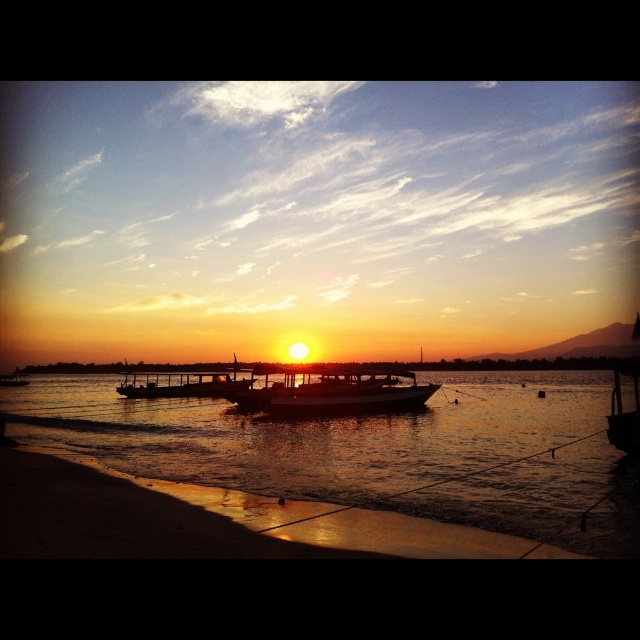
You are standing on the beach looking at the sunset. There are two points marked on the image. One is at coordinates point [154,388] and the other is at point [8,385]. Which point is closer to you?

Point [154,388] is closer to the viewer than point [8,385].

You are a photographer planning to take a sunset photo of the silvery metallic boat at center. The camera you are using has a focal length of 50mm. If you want to capture the boat in the center of the frame, which coordinate should you aim your camera at?

You should aim your camera at the coordinate point of (182, 385) to center the silvery metallic boat at center in the frame.

You are a photographer aiming to capture the sunset reflection on the water. You have two options for your shot composition. One option includes the translucent water at lower center and the metallic silver boat at lower left. Based on their sizes, which object would make a better focal point for the reflection? Please explain your reasoning.

The metallic silver boat at lower left would make a better focal point because it is larger than the translucent water at lower center, allowing its reflection to stand out more prominently in the composition.